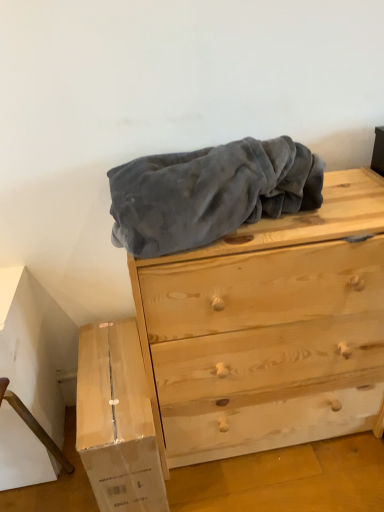
Locate an element on the screen. vacant area located to the right-hand side of white cardboard box at lower left is located at coordinates click(225, 479).